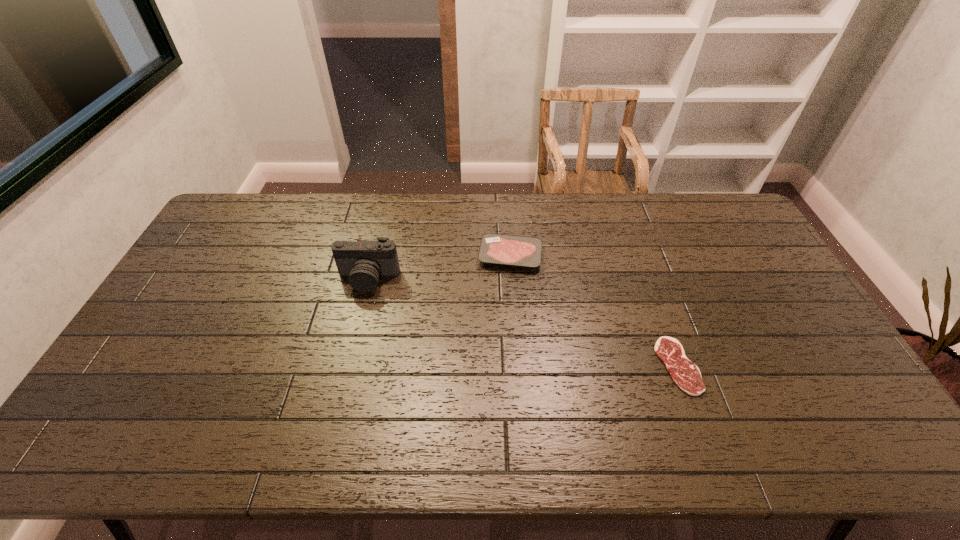
This screenshot has width=960, height=540. I want to click on free space at the near edge of the desktop, so click(x=663, y=452).

In the image, there is a desktop. Where is `vacant region at the left edge`? The height and width of the screenshot is (540, 960). vacant region at the left edge is located at coordinates (191, 339).

The image size is (960, 540). I want to click on blank space at the right edge of the desktop, so click(807, 323).

Where is `vacant space at the far left corner`? The height and width of the screenshot is (540, 960). vacant space at the far left corner is located at coordinates (267, 210).

Find the location of a particular element. This screenshot has width=960, height=540. free region at the near right corner is located at coordinates (857, 444).

Where is `vacant point located between the farther steak and the shortest object`? This screenshot has height=540, width=960. vacant point located between the farther steak and the shortest object is located at coordinates tap(594, 310).

The width and height of the screenshot is (960, 540). Identify the location of empty space between the taller steak and the shorter steak. pos(594,310).

Where is `empty space that is in between the taller steak and the leftmost object`? The height and width of the screenshot is (540, 960). empty space that is in between the taller steak and the leftmost object is located at coordinates (440, 267).

Where is `free point between the right steak and the farther steak`? This screenshot has height=540, width=960. free point between the right steak and the farther steak is located at coordinates (594, 310).

At what (x,y) coordinates should I click in order to perform the action: click on vacant point located between the leftmost object and the left steak. Please return your answer as a coordinate pair (x, y). The height and width of the screenshot is (540, 960). Looking at the image, I should click on (440, 267).